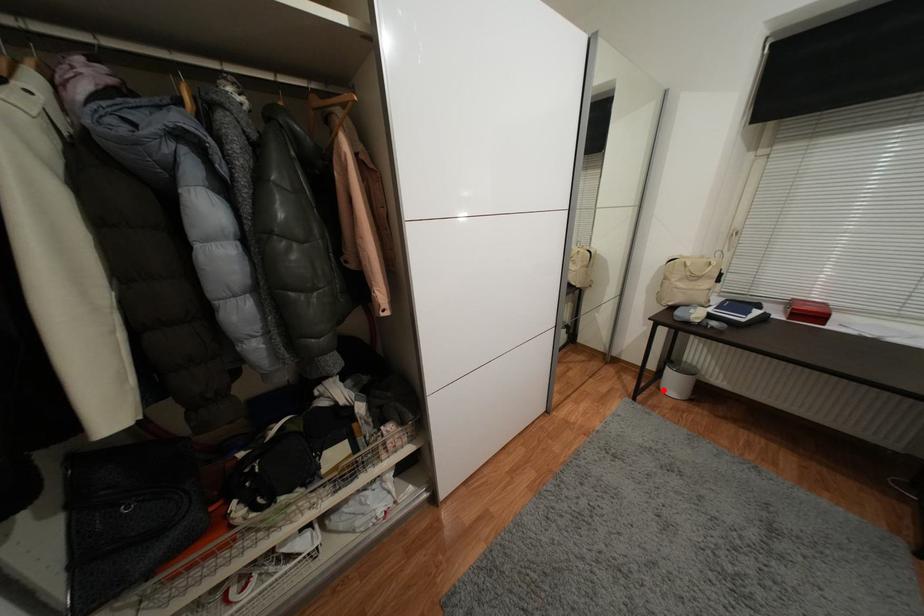
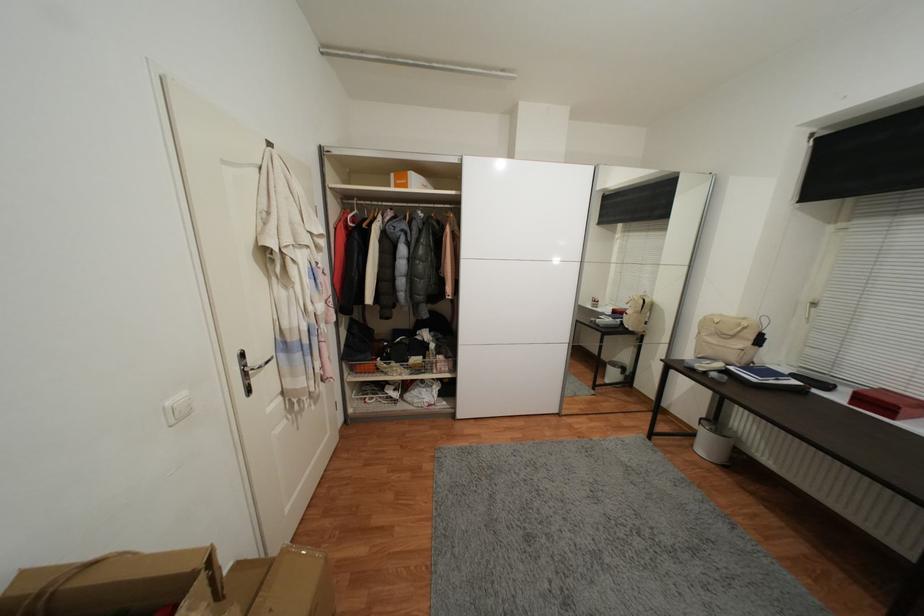
Locate, in the second image, the point that corresponds to the highlighted location in the first image.

(697, 447)